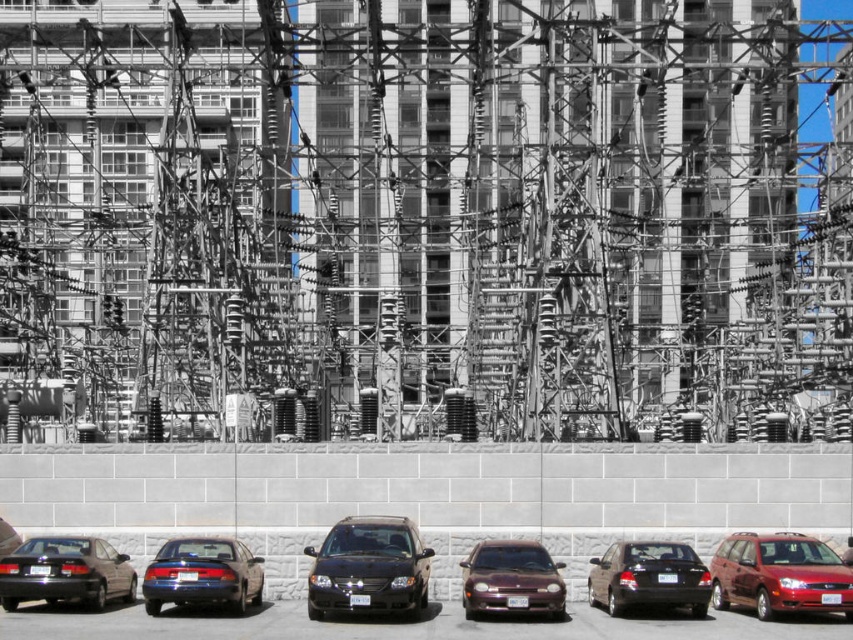
The height and width of the screenshot is (640, 853). What do you see at coordinates (648, 577) in the screenshot?
I see `shiny black sedan at lower center` at bounding box center [648, 577].

Can you confirm if shiny black sedan at lower center is positioned to the right of metallic maroon sedan at center?

Indeed, shiny black sedan at lower center is positioned on the right side of metallic maroon sedan at center.

Describe the element at coordinates (648, 577) in the screenshot. Image resolution: width=853 pixels, height=640 pixels. I see `shiny black sedan at lower center` at that location.

Where is `shiny black sedan at lower center`? shiny black sedan at lower center is located at coordinates (648, 577).

Who is positioned more to the right, shiny black van at center or shiny black sedan at lower center?

Positioned to the right is shiny black sedan at lower center.

Can you confirm if shiny black van at center is bigger than shiny black sedan at lower center?

No.

Identify the location of shiny black van at center. The width and height of the screenshot is (853, 640). (368, 566).

Is shiny red van at lower right above matte black sedan at lower left?

No, shiny red van at lower right is not above matte black sedan at lower left.

Which is more to the right, shiny red van at lower right or matte black sedan at lower left?

shiny red van at lower right is more to the right.

You are a GUI agent. You are given a task and a screenshot of the screen. Output one action in this format:
    pyautogui.click(x=<x>, y=<y>)
    Task: Click on the shiny red van at lower right
    The width and height of the screenshot is (853, 640).
    Given the screenshot: What is the action you would take?
    pyautogui.click(x=779, y=573)